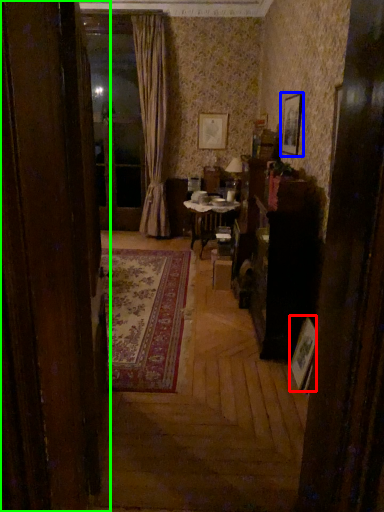
Question: Which object is the farthest from picture frame (highlighted by a red box)? Choose among these: picture frame (highlighted by a blue box) or door (highlighted by a green box).

Choices:
 (A) picture frame
 (B) door

Answer: (A)